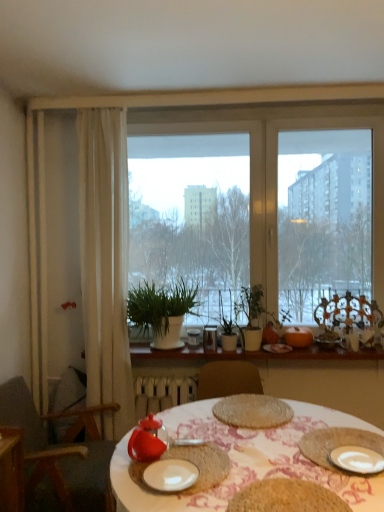
You are a GUI agent. You are given a task and a screenshot of the screen. Output one action in this format:
    pyautogui.click(x=<x>, y=<y>)
    Task: Click on the green matte plant at center
    This screenshot has width=384, height=512.
    Given the screenshot: What is the action you would take?
    pyautogui.click(x=161, y=311)

Measure the distance between point (287,337) and camera.

Point (287,337) is 9.34 feet from camera.

This screenshot has height=512, width=384. What do you see at coordinates (202, 464) in the screenshot?
I see `matte red teapot at center, which is counted as the 4th tableware, starting from the right` at bounding box center [202, 464].

The image size is (384, 512). Describe the element at coordinates (328, 340) in the screenshot. I see `matte glass bowl at right, marked as the second tableware in a back-to-front arrangement` at that location.

This screenshot has width=384, height=512. What do you see at coordinates (337, 443) in the screenshot?
I see `matte wicker placemat at lower right` at bounding box center [337, 443].

I want to click on green matte plant at center, so (161, 311).

Is green matte plant at center spatially inside matte glass bowl at right, which is the first tableware in right-to-left order, or outside of it?

green matte plant at center cannot be found inside matte glass bowl at right, which is the first tableware in right-to-left order.

Considering the sizes of objects green matte plant at center and matte glass bowl at right, which is the first tableware in right-to-left order, in the image provided, who is taller, green matte plant at center or matte glass bowl at right, which is the first tableware in right-to-left order,?

Standing taller between the two is green matte plant at center.

From the image's perspective, is green matte plant at center under matte glass bowl at right, which is counted as the 4th tableware, starting from the front?

No, from the image's perspective, green matte plant at center is not beneath matte glass bowl at right, which is counted as the 4th tableware, starting from the front.

Is green matte plant at center with matte glass bowl at right, which is counted as the 4th tableware, starting from the front?

No, green matte plant at center is not touching matte glass bowl at right, which is counted as the 4th tableware, starting from the front.

Based on the photo, who is more distant, matte glass bowl at right, which is the first tableware in right-to-left order, or matte wicker placemat at lower right?

matte glass bowl at right, which is the first tableware in right-to-left order, is more distant.

Can you confirm if matte glass bowl at right, positioned as the 5th tableware in left-to-right order, is taller than matte wicker placemat at lower right?

Yes.

Based on their sizes in the image, would you say matte glass bowl at right, which is counted as the 4th tableware, starting from the front, is bigger or smaller than matte wicker placemat at lower right?

matte glass bowl at right, which is counted as the 4th tableware, starting from the front, is bigger than matte wicker placemat at lower right.

Does point (201, 450) come behind point (285, 106)?

No, (201, 450) is closer to viewer.

In the image, is matte red teapot at center, which is counted as the fifth tableware, starting from the back, positioned in front of or behind transparent glass window at center?

Visually, matte red teapot at center, which is counted as the fifth tableware, starting from the back, is located in front of transparent glass window at center.

Do you think matte red teapot at center, acting as the 1th tableware starting from the front, is within transparent glass window at center, or outside of it?

The correct answer is: outside.

Is transparent glass window at center at the back of matte red teapot at center, which is the second tableware in left-to-right order?

No.

Measure the distance between transparent glass teapot at lower left, arranged as the first tableware when viewed from the left, and white ceramic plate at lower right, the second plate from the left.

27.54 inches.

From their relative heights in the image, would you say transparent glass teapot at lower left, the fourth tableware viewed from the back, is taller or shorter than white ceramic plate at lower right, the 1th plate from the right?

In the image, transparent glass teapot at lower left, the fourth tableware viewed from the back, appears to be taller than white ceramic plate at lower right, the 1th plate from the right.

At what (x,y) coordinates should I click in order to perform the action: click on the 1st plate in front of the transparent glass teapot at lower left, the fifth tableware in the right-to-left sequence, starting your count from the anchor. Please return your answer as a coordinate pair (x, y). Looking at the image, I should click on 357,459.

Which is correct: transparent glass teapot at lower left, the fourth tableware viewed from the back, is inside white ceramic plate at lower right, the second plate from the left, or outside of it?

transparent glass teapot at lower left, the fourth tableware viewed from the back, is outside white ceramic plate at lower right, the second plate from the left.

Does transparent glass window at center lie in front of brown woven placemat at center, acting as the second food starting from the top?

That is False.

From a real-world perspective, does transparent glass window at center stand above brown woven placemat at center, acting as the second food starting from the top?

Yes, from a real-world perspective, transparent glass window at center is on top of brown woven placemat at center, acting as the second food starting from the top.

Where is `the 2nd food below the transparent glass window at center (from a real-world perspective)`? Image resolution: width=384 pixels, height=512 pixels. the 2nd food below the transparent glass window at center (from a real-world perspective) is located at coordinates (286, 497).

Is matte wicker placemat at lower right positioned before transparent glass teapot at lower left, arranged as the first tableware when viewed from the left?

Yes, matte wicker placemat at lower right is closer to the camera.

In order to click on tableware that is the 1st one when counting backward from the matte wicker placemat at lower right in this screenshot , I will do `click(147, 440)`.

Considering the sizes of objects matte wicker placemat at lower right and transparent glass teapot at lower left, the fifth tableware in the right-to-left sequence, in the image provided, who is bigger, matte wicker placemat at lower right or transparent glass teapot at lower left, the fifth tableware in the right-to-left sequence,?

transparent glass teapot at lower left, the fifth tableware in the right-to-left sequence.

Can you confirm if matte wicker placemat at lower right is thinner than transparent glass teapot at lower left, the fourth tableware viewed from the back?

No, matte wicker placemat at lower right is not thinner than transparent glass teapot at lower left, the fourth tableware viewed from the back.

Does point (82, 492) lie behind point (151, 436)?

Yes.

Is wooden chair at left spatially inside transparent glass teapot at lower left, which is the second tableware in front-to-back order, or outside of it?

wooden chair at left is spatially situated outside transparent glass teapot at lower left, which is the second tableware in front-to-back order.

Is wooden chair at left turned away from transparent glass teapot at lower left, the fourth tableware viewed from the back?

No, transparent glass teapot at lower left, the fourth tableware viewed from the back, is not at the back of wooden chair at left.

Are wooden chair at left and transparent glass teapot at lower left, the fifth tableware in the right-to-left sequence, making contact?

wooden chair at left is not next to transparent glass teapot at lower left, the fifth tableware in the right-to-left sequence, and they're not touching.

Where is `plant positioned vertically above the matte glass bowl at right, marked as the second tableware in a back-to-front arrangement (from a real-world perspective)`? plant positioned vertically above the matte glass bowl at right, marked as the second tableware in a back-to-front arrangement (from a real-world perspective) is located at coordinates (252, 316).

Starting from the matte wicker placemat at lower right, which tableware is the 3rd one behind? Please provide its 2D coordinates.

[(328, 340)]

Looking at the image, which one is located closer to baked golden bread at center, marked as the second food in a bottom-to-top arrangement, transparent glass window at center or transparent glass teapot at lower left, the fourth tableware viewed from the back?

transparent glass teapot at lower left, the fourth tableware viewed from the back.

When comparing their distances from wooden chair at left, does matte glass bowl at right, which is the first tableware in right-to-left order, or matte wicker placemat at lower right seem closer?

Among the two, matte wicker placemat at lower right is located nearer to wooden chair at left.

Which object lies nearer to the anchor point matte wicker placemat at lower right, white ceramic plate at lower right, the second plate from the left, or matte red teapot at center, which is counted as the fifth tableware, starting from the back?

Among the two, white ceramic plate at lower right, the second plate from the left, is located nearer to matte wicker placemat at lower right.

Estimate the real-world distances between objects in this image. Which object is closer to white sheer curtain at left, white matte plate at center, the first plate when ordered from left to right, or matte red teapot at center, which is the second tableware in left-to-right order?

matte red teapot at center, which is the second tableware in left-to-right order, lies closer to white sheer curtain at left than the other object.

Estimate the real-world distances between objects in this image. Which object is closer to wooden chair at left, matte orange pumpkin at center, acting as the 3th tableware starting from the front, or wooden at center?

wooden at center lies closer to wooden chair at left than the other object.

Based on their spatial positions, is baked golden bread at center, marked as the second food in a bottom-to-top arrangement, or brown woven placemat at center, acting as the second food starting from the top, closer to white ceramic plate at lower right, the second plate from the left?

brown woven placemat at center, acting as the second food starting from the top, is positioned closer to the anchor white ceramic plate at lower right, the second plate from the left.

Based on their spatial positions, is green matte plant at center or matte red teapot at center, which is the second tableware in left-to-right order, closer to transparent glass window at center?

Among the two, green matte plant at center is located nearer to transparent glass window at center.

Estimate the real-world distances between objects in this image. Which object is further from matte red teapot at center, acting as the 1th tableware starting from the front, green matte plant at center or orange matte pumpkin at right, the second tableware viewed from the right?

orange matte pumpkin at right, the second tableware viewed from the right, lies further to matte red teapot at center, acting as the 1th tableware starting from the front, than the other object.

The height and width of the screenshot is (512, 384). I want to click on chair between matte white table at center and green matte plant at center in the front-back direction, so click(55, 459).

The image size is (384, 512). I want to click on houseplant between matte wicker placemat at lower right and matte orange pumpkin at center, acting as the 3th tableware starting from the front, from front to back, so click(161, 311).

The height and width of the screenshot is (512, 384). I want to click on chair between transparent glass teapot at lower left, which is the second tableware in front-to-back order, and white sheer curtain at left in the front-back direction, so click(55, 459).

The height and width of the screenshot is (512, 384). Identify the location of plant between white matte plate at center, the first plate when ordered from left to right, and wooden at center from front to back. (252, 316).